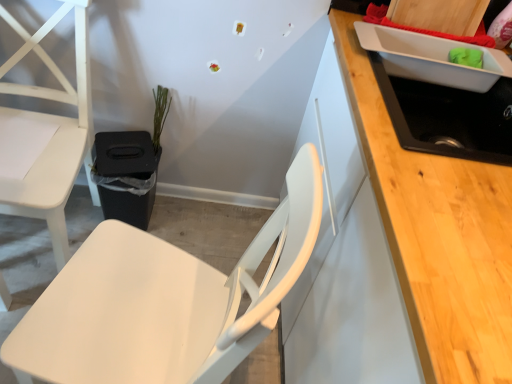
Question: From a real-world perspective, is white matte chair at left, which is counted as the first chair, starting from the left, physically located above or below matte white chair at center, which is counted as the 1th chair, starting from the right?

Choices:
 (A) above
 (B) below

Answer: (B)

Question: In the image, is white matte chair at left, which is counted as the first chair, starting from the left, positioned in front of or behind matte white chair at center, which is counted as the 1th chair, starting from the right?

Choices:
 (A) behind
 (B) front

Answer: (A)

Question: Which of these objects is positioned farthest from the black matte sink at upper right?

Choices:
 (A) white matte chair at left, the second chair positioned from the right
 (B) green matte plant at center
 (C) matte white chair at center, which is counted as the 1th chair, starting from the right

Answer: (A)

Question: Estimate the real-world distances between objects in this image. Which object is closer to the black matte sink at upper right?

Choices:
 (A) white matte chair at left, which is counted as the first chair, starting from the left
 (B) matte white chair at center, which is counted as the 1th chair, starting from the right
 (C) green matte plant at center

Answer: (B)